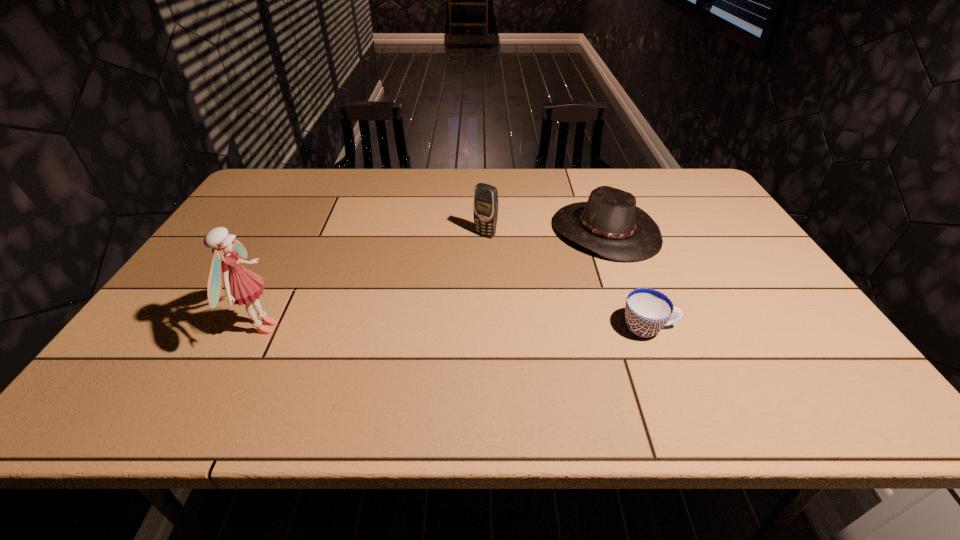
Locate an element on the screen. vacant space in between the shortest object and the cellular telephone is located at coordinates (567, 281).

The image size is (960, 540). I want to click on empty space that is in between the third object from right to left and the leftmost object, so click(x=373, y=281).

Identify the location of vacant region between the tallest object and the shortest object. (455, 328).

Point out which object is positioned as the third nearest to the second object from left to right. Please provide its 2D coordinates. Your answer should be formatted as a tuple, i.e. [(x, y)], where the tuple contains the x and y coordinates of a point satisfying the conditions above.

[(242, 286)]

The height and width of the screenshot is (540, 960). What are the coordinates of `object that is the second nearest to the third tallest object` in the screenshot? It's located at (647, 311).

I want to click on free spot that satisfies the following two spatial constraints: 1. on the front side of the second tallest object; 2. on the side of the shortest object with the handle, so click(x=487, y=328).

The width and height of the screenshot is (960, 540). Identify the location of vacant space that satisfies the following two spatial constraints: 1. on the back side of the third tallest object; 2. on the left side of the second tallest object. (486, 231).

Identify the location of vacant space that satisfies the following two spatial constraints: 1. on the front side of the hat; 2. on the side of the cup with the handle. The width and height of the screenshot is (960, 540). (642, 328).